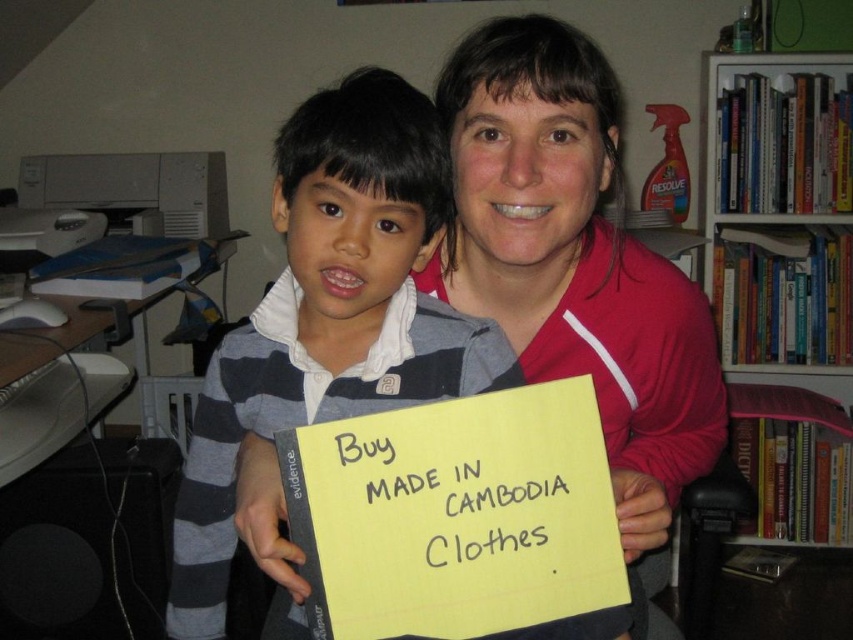
Is striped cotton shirt at center bigger than yellow paper at center?

Indeed, striped cotton shirt at center has a larger size compared to yellow paper at center.

Between striped cotton shirt at center and yellow paper at center, which one has less height?

With less height is yellow paper at center.

What do you see at coordinates (329, 314) in the screenshot?
I see `striped cotton shirt at center` at bounding box center [329, 314].

Where is `striped cotton shirt at center`? The height and width of the screenshot is (640, 853). striped cotton shirt at center is located at coordinates (329, 314).

Who is positioned more to the right, striped cotton shirt at center or white paperboard bookshelf at upper right?

white paperboard bookshelf at upper right is more to the right.

Is point (409, 136) in front of point (750, 202)?

Yes, point (409, 136) is in front of point (750, 202).

Is point (358, 128) more distant than point (814, 371)?

No, it is in front of (814, 371).

I want to click on striped cotton shirt at center, so click(x=329, y=314).

Is point (712, 72) closer to camera compared to point (529, 493)?

No, (712, 72) is behind (529, 493).

Between white paperboard bookshelf at upper right and yellow paper at center, which one has less height?

With less height is yellow paper at center.

Locate an element on the screen. white paperboard bookshelf at upper right is located at coordinates (780, 211).